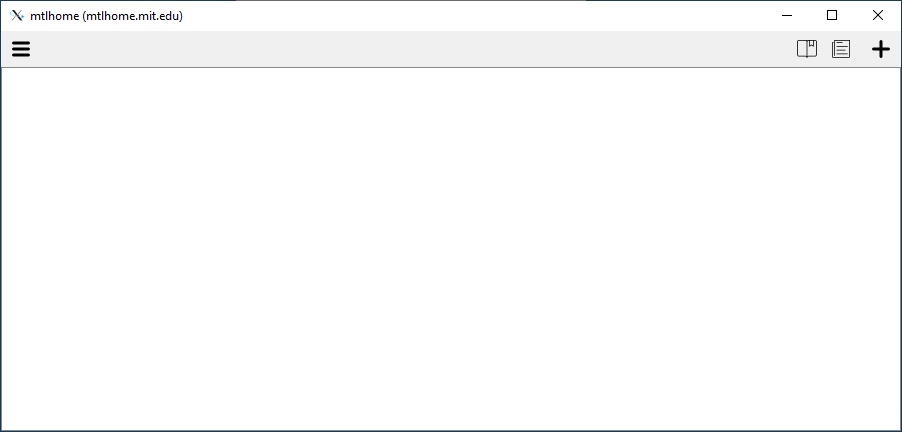
At what (x,y) coordinates should I click in order to perform the action: click on white bar. Please return your answer as a coordinate pair (x, y). The width and height of the screenshot is (902, 432). Looking at the image, I should click on (282, 17).